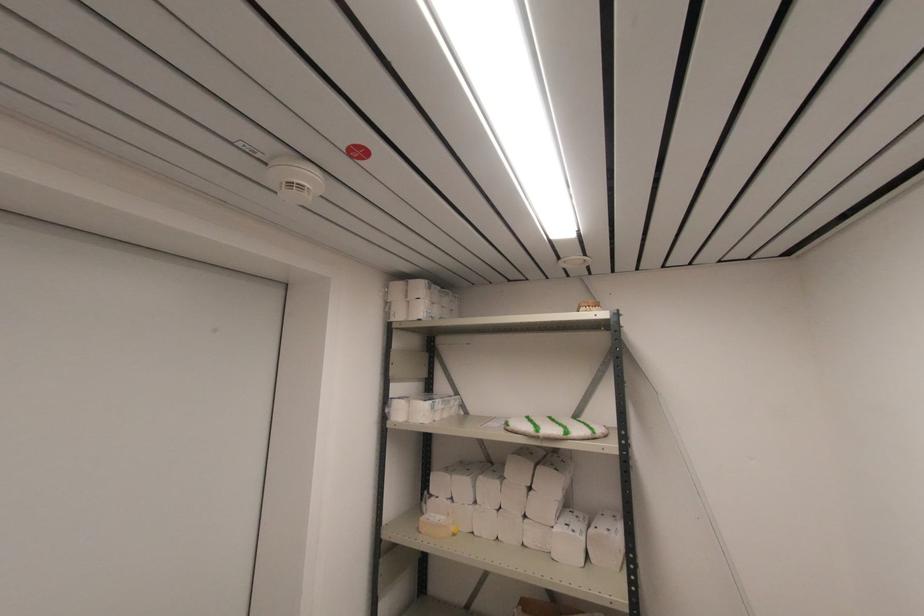
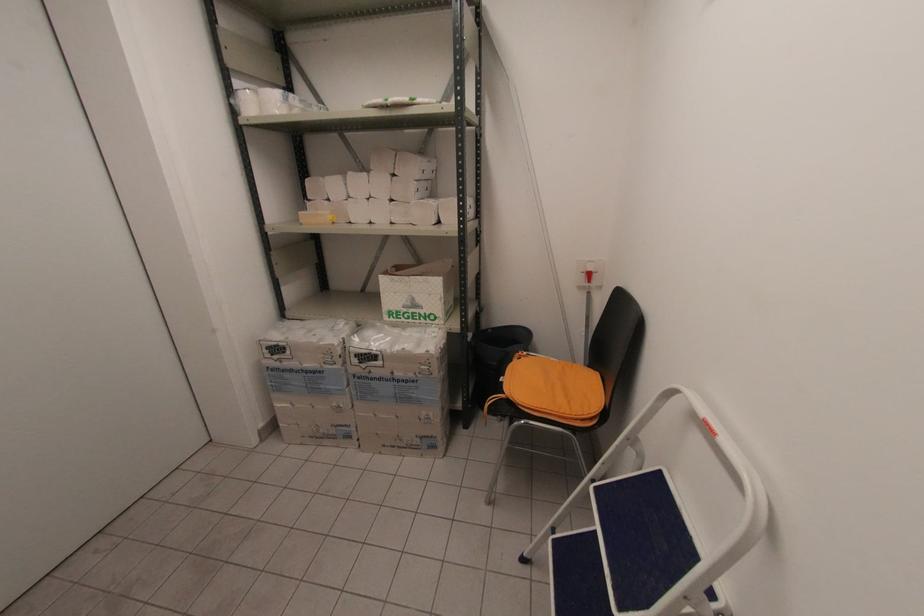
Question: Based on the continuous images, in which direction is the camera rotating? Reply with the corresponding letter.

Choices:
 (A) Left
 (B) Right
 (C) Up
 (D) Down

Answer: (D)